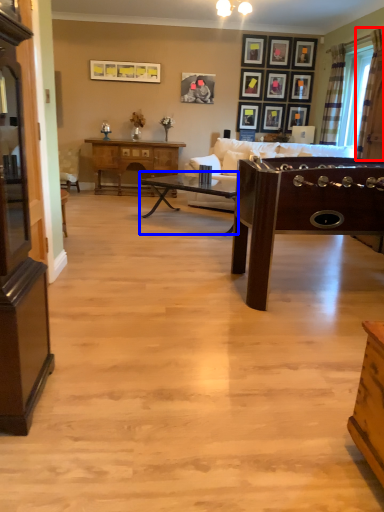
Question: Which of the following is the farthest to the observer, curtain (highlighted by a red box) or table (highlighted by a blue box)?

Choices:
 (A) curtain
 (B) table

Answer: (B)